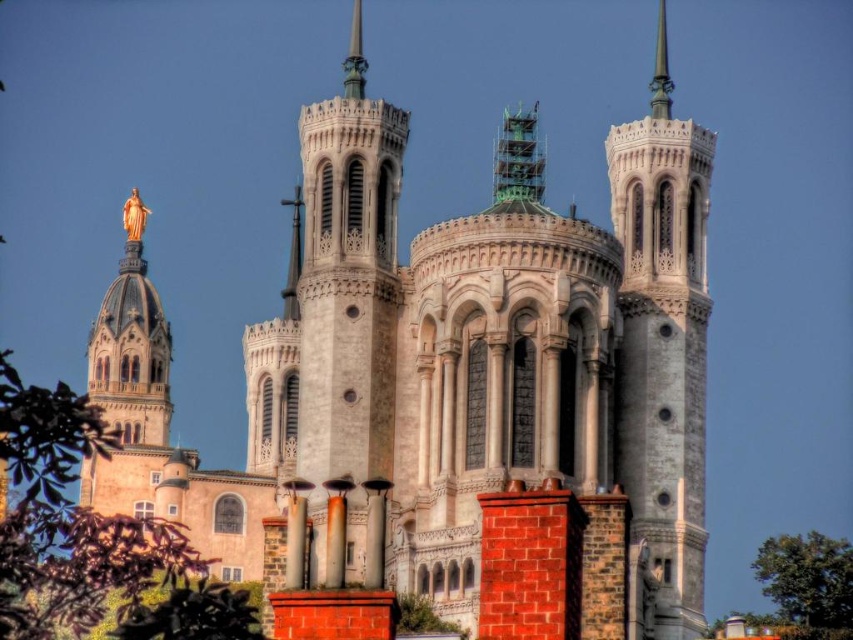
Does white stone spire at center have a smaller size compared to polished silver spire at upper right?

Correct, white stone spire at center occupies less space than polished silver spire at upper right.

Does white stone spire at center appear under polished silver spire at upper right?

Yes.

Where is `white stone spire at center`? The image size is (853, 640). white stone spire at center is located at coordinates (663, 355).

Identify the location of white stone spire at center. The image size is (853, 640). (663, 355).

Who is higher up, white stone spire at center or polished bronze spire at center?

polished bronze spire at center is above.

How distant is white stone spire at center from polished bronze spire at center?

The distance of white stone spire at center from polished bronze spire at center is 21.40 meters.

This screenshot has width=853, height=640. I want to click on white stone spire at center, so click(663, 355).

Is green leafy tree at lower right below polished silver spire at upper right?

Correct, green leafy tree at lower right is located below polished silver spire at upper right.

Can you confirm if green leafy tree at lower right is positioned to the right of polished silver spire at upper right?

Correct, you'll find green leafy tree at lower right to the right of polished silver spire at upper right.

Identify the location of green leafy tree at lower right. This screenshot has height=640, width=853. pos(808,580).

Image resolution: width=853 pixels, height=640 pixels. Find the location of `green leafy tree at lower right`. green leafy tree at lower right is located at coordinates (808, 580).